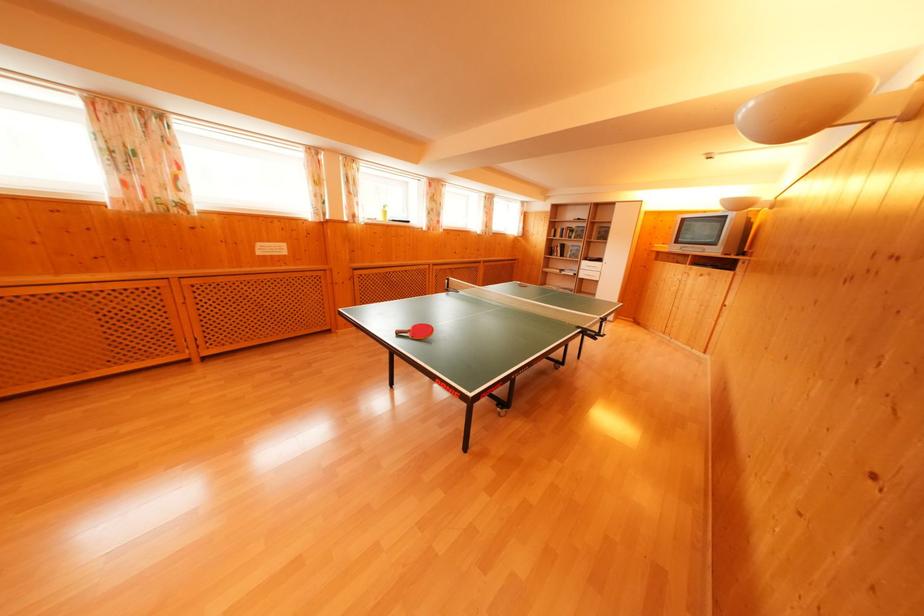
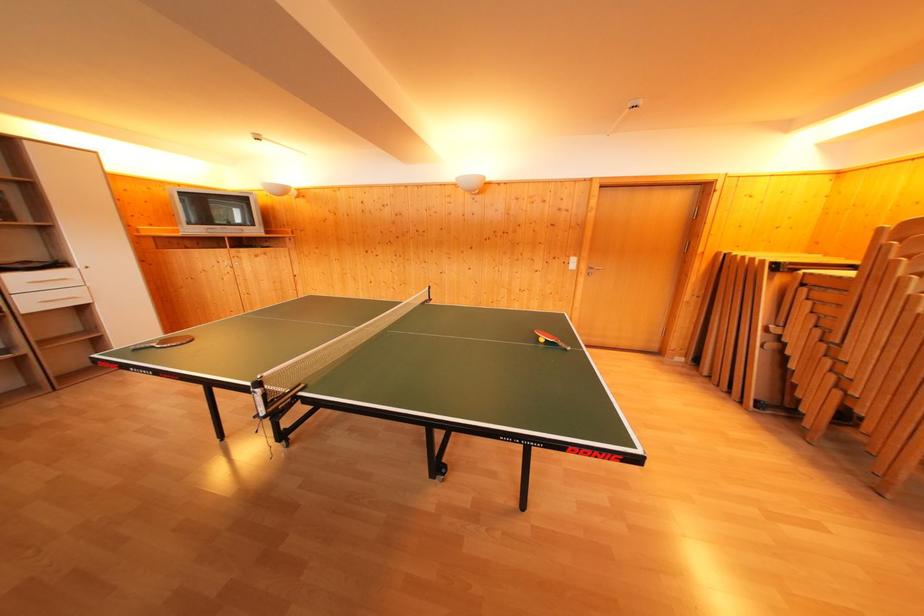
Locate, in the second image, the point that corresponds to pixel 604 265 in the first image.

(64, 270)